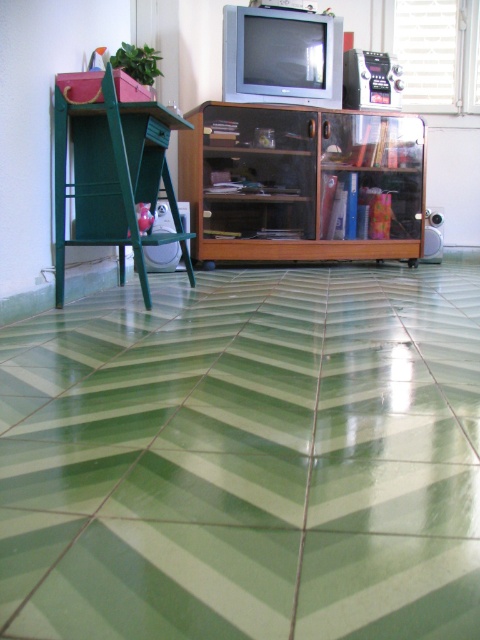
Question: Which point appears closest to the camera in this image?

Choices:
 (A) (127, 216)
 (B) (294, 625)

Answer: (B)

Question: Is wooden cabinet at center thinner than green matte stool at left?

Choices:
 (A) yes
 (B) no

Answer: (B)

Question: Among these objects, which one is nearest to the camera?

Choices:
 (A) green matte stool at left
 (B) wooden cabinet at center
 (C) green glossy tile at center

Answer: (C)

Question: Can you confirm if wooden cabinet at center is bigger than green matte stool at left?

Choices:
 (A) no
 (B) yes

Answer: (B)

Question: Is wooden cabinet at center behind green matte stool at left?

Choices:
 (A) no
 (B) yes

Answer: (B)

Question: Which object is positioned closest to the green glossy tile at center?

Choices:
 (A) green matte stool at left
 (B) wooden cabinet at center

Answer: (A)